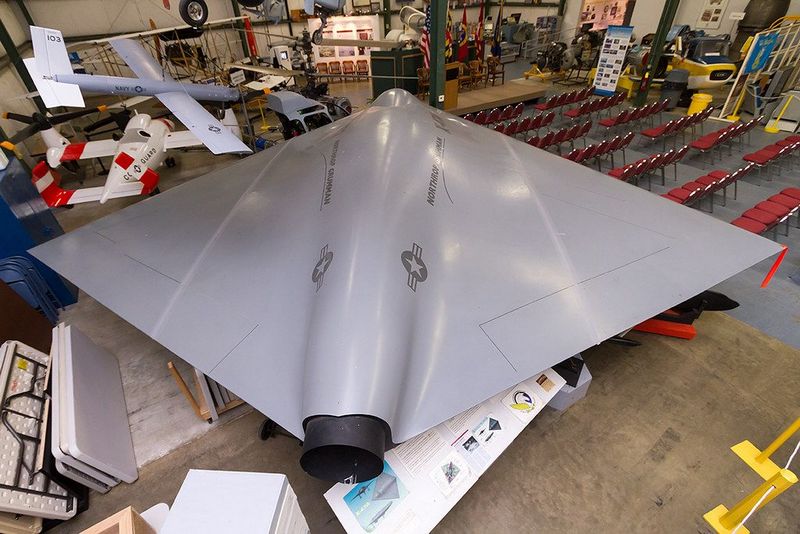
I want to click on bucket, so click(694, 104).